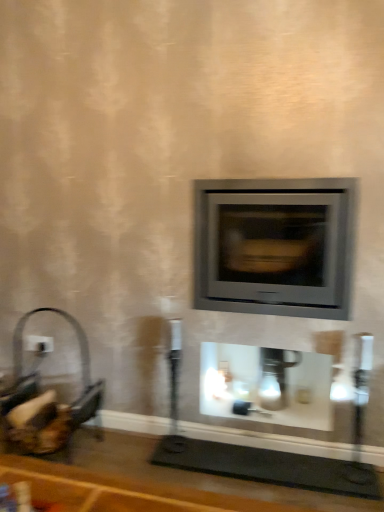
Question: Visually, is white plastic electric outlet at left positioned to the left or to the right of white glossy fireplace at center?

Choices:
 (A) right
 (B) left

Answer: (B)

Question: Is point (41, 345) positioned closer to the camera than point (329, 421)?

Choices:
 (A) farther
 (B) closer

Answer: (A)

Question: Which object is positioned farthest from the matte gray wood burning stove at center?

Choices:
 (A) white glossy fireplace at center
 (B) white plastic electric outlet at left

Answer: (B)

Question: Considering the real-world distances, which object is closest to the matte gray wood burning stove at center?

Choices:
 (A) white glossy fireplace at center
 (B) white plastic electric outlet at left

Answer: (A)